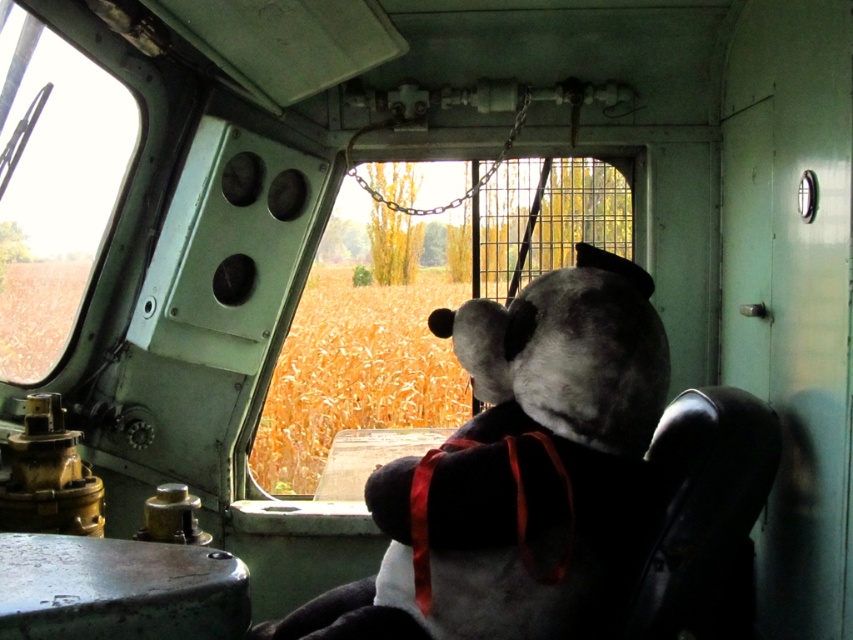
Question: Is soft plush teddy bear at center to the left of clear glass window at center from the viewer's perspective?

Choices:
 (A) no
 (B) yes

Answer: (A)

Question: Which point is closer to the camera?

Choices:
 (A) (111, 132)
 (B) (560, 362)

Answer: (B)

Question: Which of the following is the closest to the observer?

Choices:
 (A) (418, 572)
 (B) (42, 365)

Answer: (A)

Question: Which point is farther to the camera?

Choices:
 (A) soft plush teddy bear at center
 (B) clear glass window at center

Answer: (B)

Question: Does soft plush teddy bear at center lie in front of clear glass window at center?

Choices:
 (A) yes
 (B) no

Answer: (A)

Question: Observing the image, what is the correct spatial positioning of clear glass window at center in reference to transparent glass window at upper left?

Choices:
 (A) right
 (B) left

Answer: (A)